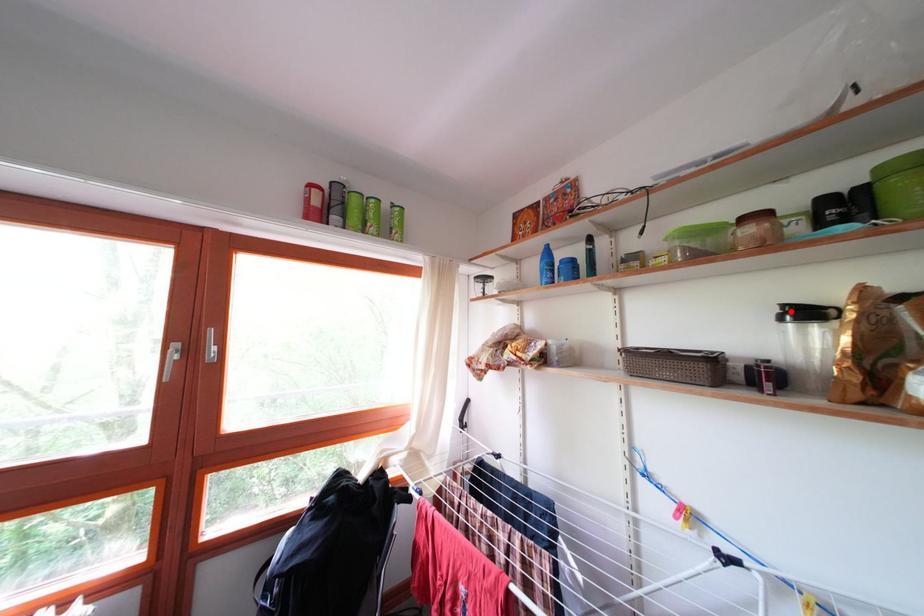
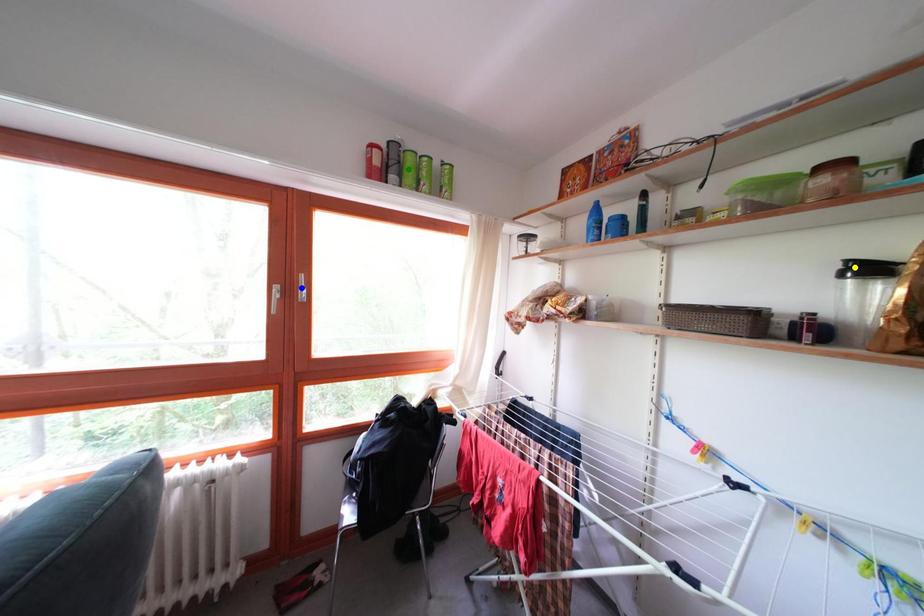
Question: I am providing you with two images of the same scene from different viewpoints. A red point is marked on the first image. You are given multiple points on the second image. Which spot in image 2 lines up with the point in image 1?

Choices:
 (A) yellow point
 (B) blue point
 (C) green point

Answer: (A)